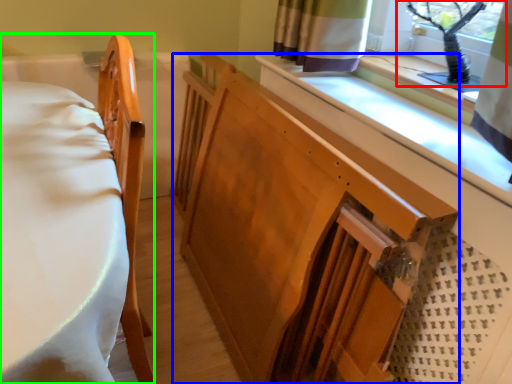
Question: Estimate the real-world distances between objects in this image. Which object is closer to window screen (highlighted by a red box), changing table (highlighted by a blue box) or furniture (highlighted by a green box)?

Choices:
 (A) changing table
 (B) furniture

Answer: (A)